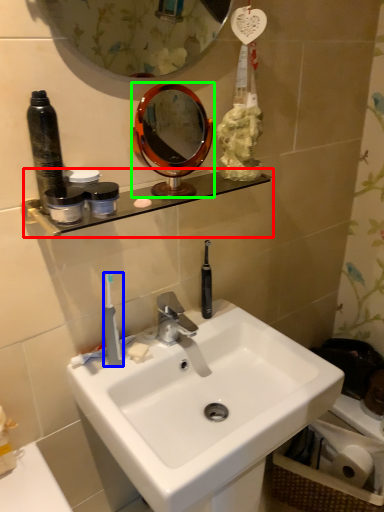
Question: Based on their relative distances, which object is nearer to shelve (highlighted by a red box)? Choose from toothbrush (highlighted by a blue box) and mirror (highlighted by a green box).

Choices:
 (A) toothbrush
 (B) mirror

Answer: (A)